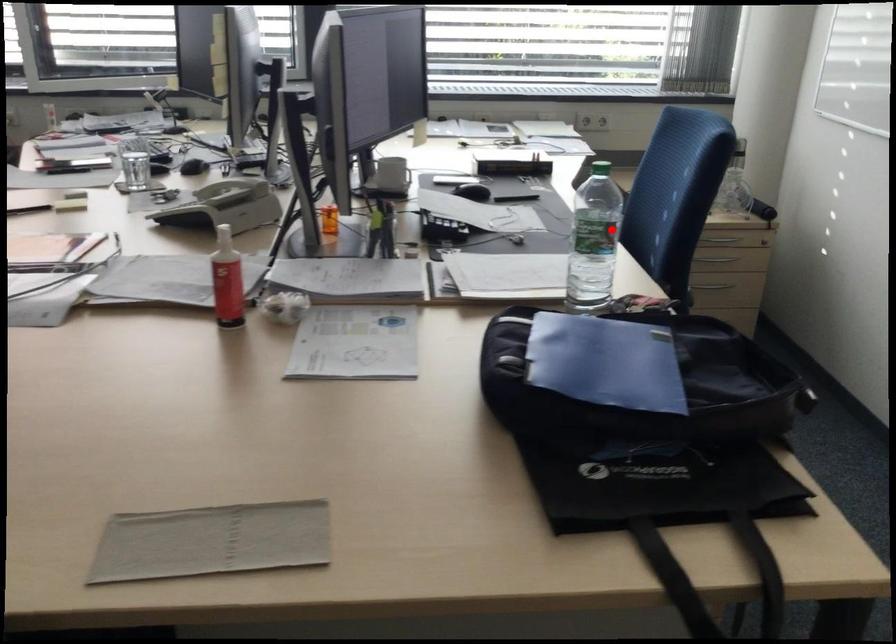
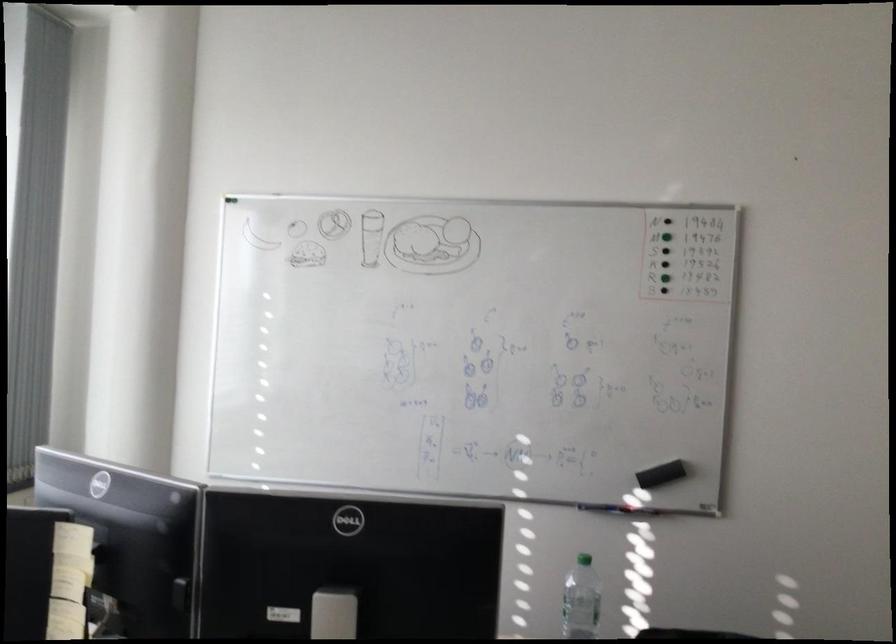
Question: A red point is marked in image1. In image2, is the corresponding 3D point closer to the camera or farther? Reply with the corresponding letter.

Choices:
 (A) The corresponding 3D point is closer.
 (B) The corresponding 3D point is farther.

Answer: (B)